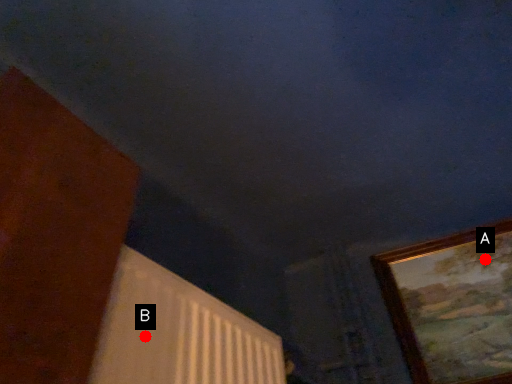
Question: Two points are circled on the image, labeled by A and B beside each circle. Which of the following is the farthest from the observer?

Choices:
 (A) A is further
 (B) B is further

Answer: (A)